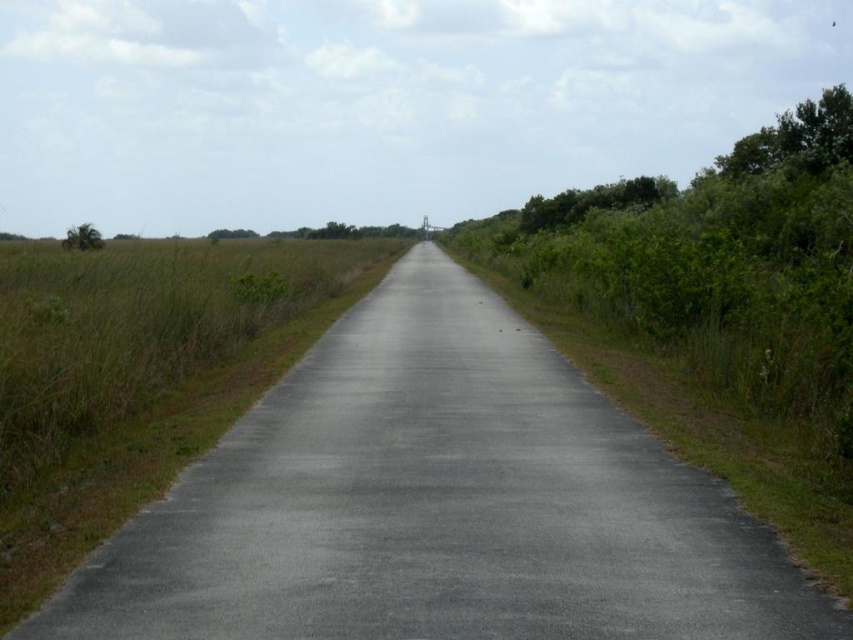
You are a hiker trying to determine the best path to avoid obstacles. You see the green grass at center and the green leafy tree at upper right. Which object is closer to you?

The green grass at center is closer to you because it appears smaller than the green leafy tree at upper right, which is further away.

You are driving a truck that is 2.5 meters wide. You see the gray asphalt road at center and the green leafy tree at right. Can your truck safely pass through the road without hitting the tree?

The gray asphalt road at center has a lesser width compared to green leafy tree at right. Since the truck is 2.5 meters wide, the road is narrower than the tree, but the description does not provide specific measurements. It is uncertain if the road is wide enough for the truck to pass safely without additional information about the actual width of the road.